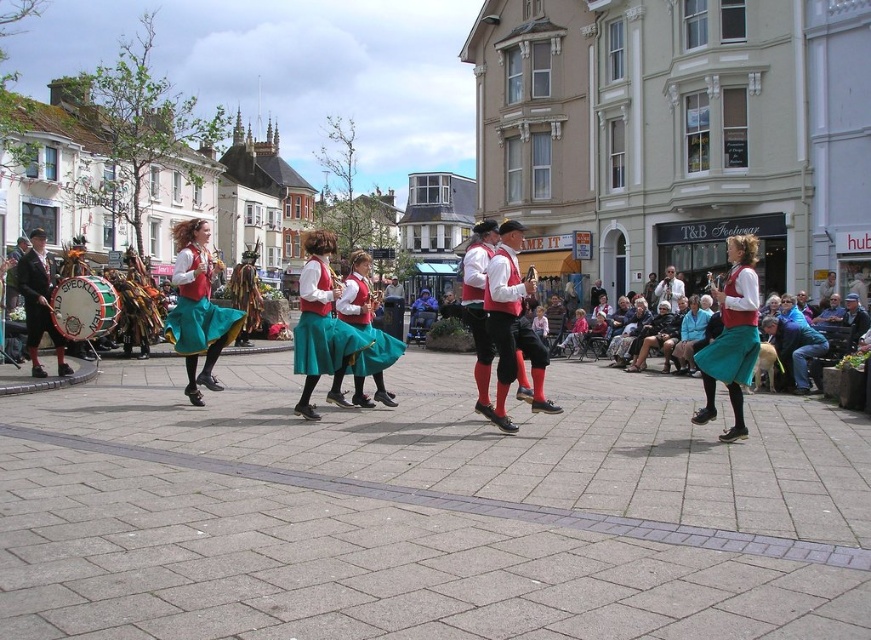
Question: Does teal fabric skirts at center have a lesser width compared to light brown leather jacket at center?

Choices:
 (A) yes
 (B) no

Answer: (B)

Question: Which object is the farthest from the green velvet skirt at center?

Choices:
 (A) light brown leather jacket at center
 (B) teal fabric skirts at center

Answer: (A)

Question: Which object is the farthest from the teal fabric skirts at center?

Choices:
 (A) matte black drum at left
 (B) light brown leather jacket at center
 (C) matte red vest at center
 (D) velvet green skirt at center

Answer: (B)

Question: Which of the following is the farthest from the observer?

Choices:
 (A) teal fabric skirts at center
 (B) velvet green skirt at center
 (C) matte red skirt at center

Answer: (B)

Question: Can you confirm if matte red skirt at center is positioned below green velvet skirt at center?

Choices:
 (A) no
 (B) yes

Answer: (A)

Question: Does teal fabric skirts at center have a smaller size compared to green fabric drum at left?

Choices:
 (A) no
 (B) yes

Answer: (A)